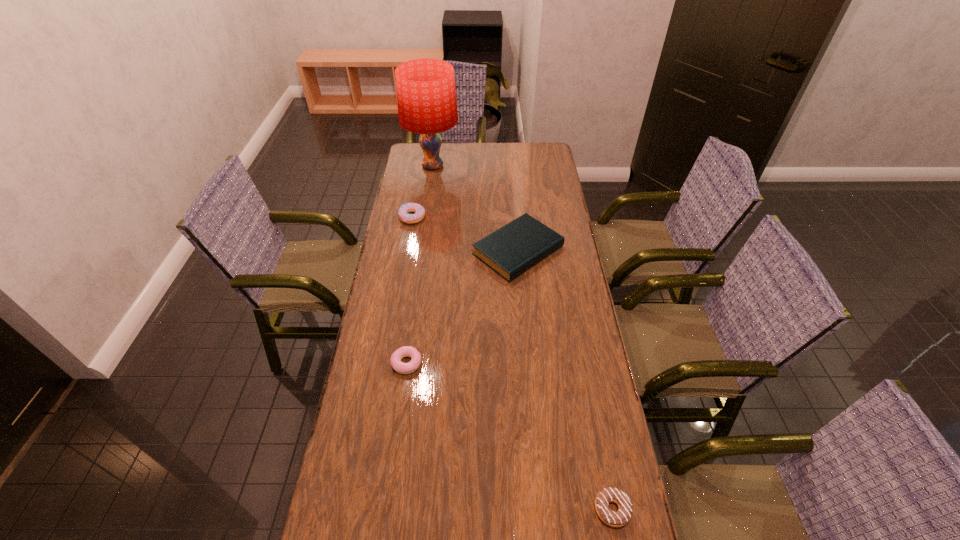
Where is `free space located 0.340m on the right of the second nearest object`? This screenshot has height=540, width=960. free space located 0.340m on the right of the second nearest object is located at coordinates (532, 363).

The image size is (960, 540). In order to click on vacant position located 0.070m on the back of the nearest object in this screenshot , I will do `click(603, 462)`.

This screenshot has width=960, height=540. Find the location of `object that is at the far edge`. object that is at the far edge is located at coordinates (426, 96).

Where is `lampshade positioned at the left edge`? This screenshot has width=960, height=540. lampshade positioned at the left edge is located at coordinates (426, 96).

This screenshot has width=960, height=540. I want to click on book that is at the right edge, so click(x=511, y=250).

Identify the location of doughnut that is at the right edge. (620, 518).

You are a GUI agent. You are given a task and a screenshot of the screen. Output one action in this format:
    pyautogui.click(x=<x>, y=<y>)
    Task: Click on the object positioned at the far left corner
    
    Given the screenshot: What is the action you would take?
    pyautogui.click(x=426, y=96)

You are a GUI agent. You are given a task and a screenshot of the screen. Output one action in this format:
    pyautogui.click(x=<x>, y=<y>)
    Task: Click on the free space at the far edge of the desktop
    This screenshot has height=540, width=960.
    Given the screenshot: What is the action you would take?
    pyautogui.click(x=514, y=158)

At what (x,y) coordinates should I click in order to perform the action: click on free space at the left edge of the desktop. Please return your answer as a coordinate pair (x, y). The image size is (960, 540). Looking at the image, I should click on (401, 187).

Find the location of `free space at the right edge of the desktop`. free space at the right edge of the desktop is located at coordinates (532, 208).